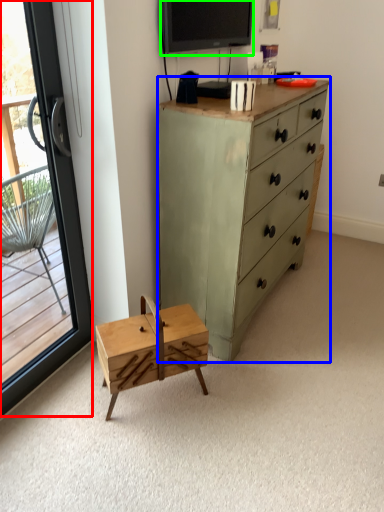
Question: Estimate the real-world distances between objects in this image. Which object is farther from window (highlighted by a red box), chest of drawers (highlighted by a blue box) or television (highlighted by a green box)?

Choices:
 (A) chest of drawers
 (B) television

Answer: (B)